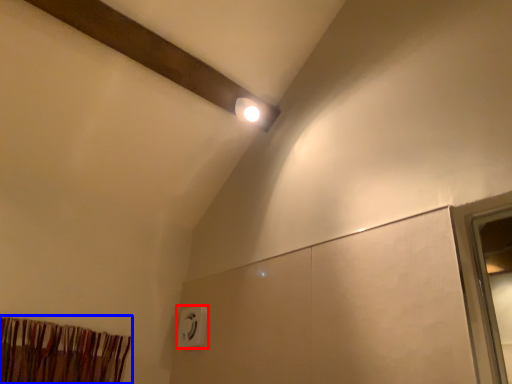
Question: Which object is closer to the camera taking this photo, electric outlet (highlighted by a red box) or curtain (highlighted by a blue box)?

Choices:
 (A) electric outlet
 (B) curtain

Answer: (B)